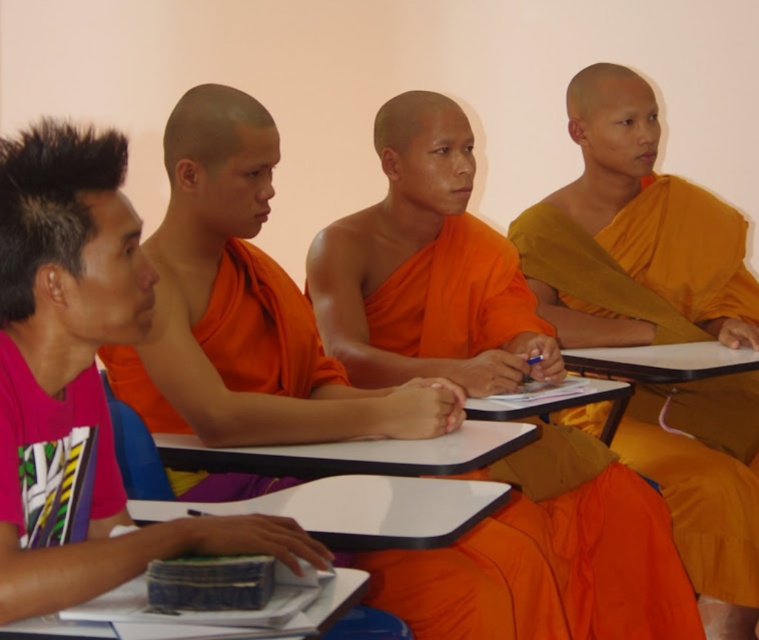
Looking at this image, you are standing in the classroom and need to locate the orange silk robe at center. According to the coordinates provided, where exactly is it positioned?

The orange silk robe at center is located at point 0.481 along the x axis and 0.323 along the y axis.